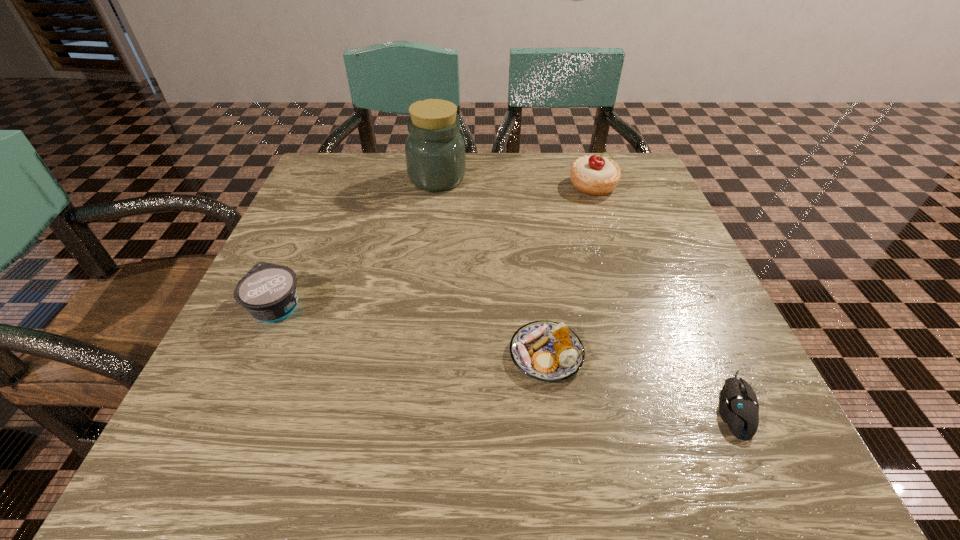
The image size is (960, 540). What are the coordinates of `the fourth object from right to left` in the screenshot? It's located at (435, 156).

Where is `jar`? This screenshot has height=540, width=960. jar is located at coordinates (435, 156).

Locate an element on the screen. the farther pastry is located at coordinates (595, 175).

In order to click on the second object from right to left in this screenshot , I will do `click(595, 175)`.

The height and width of the screenshot is (540, 960). I want to click on the third shortest object, so click(268, 292).

Identify the location of yogurt. The image size is (960, 540). (268, 292).

Image resolution: width=960 pixels, height=540 pixels. Find the location of `the shorter pastry`. the shorter pastry is located at coordinates (548, 351).

Find the location of `the nearer pastry`. the nearer pastry is located at coordinates (548, 351).

The height and width of the screenshot is (540, 960). What are the coordinates of `the shortest object` in the screenshot? It's located at (738, 407).

The height and width of the screenshot is (540, 960). In order to click on the rightmost object in this screenshot , I will do `click(738, 407)`.